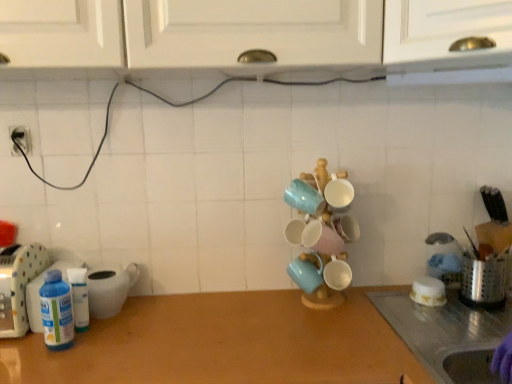
Locate an element on the screen. free spot to the left of matte blue mug at center, the first tableware viewed from the left is located at coordinates (244, 313).